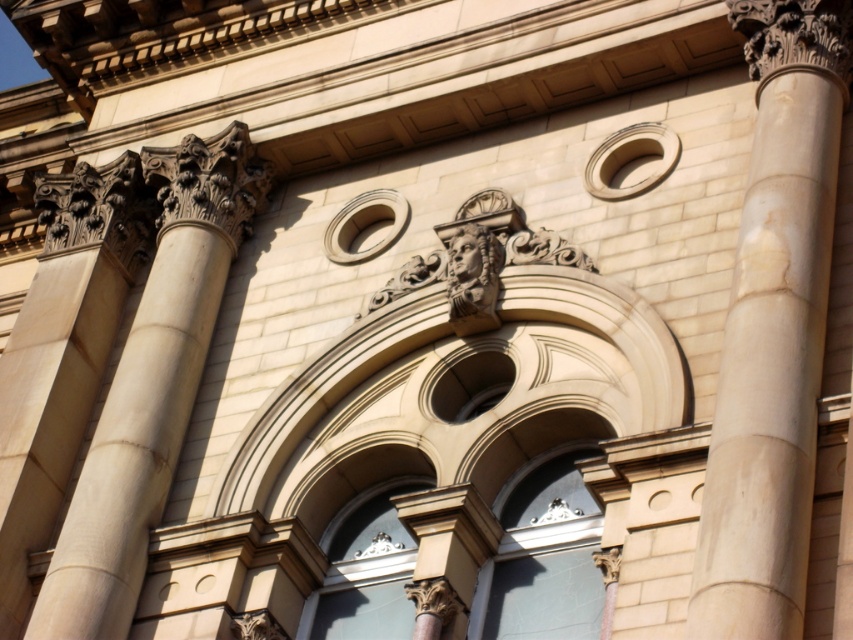
Question: Which is farther from the beige marble column at center?

Choices:
 (A) beige stone column at left
 (B) carved stone face at center

Answer: (A)

Question: Does beige stone column at left appear on the right side of carved stone face at center?

Choices:
 (A) no
 (B) yes

Answer: (A)

Question: Does beige marble column at center lie in front of beige stone column at left?

Choices:
 (A) no
 (B) yes

Answer: (B)

Question: Among these points, which one is farthest from the camera?

Choices:
 (A) (788, 541)
 (B) (479, 257)

Answer: (B)

Question: Is beige stone column at left below carved stone face at center?

Choices:
 (A) no
 (B) yes

Answer: (B)

Question: Which of the following is the closest to the observer?

Choices:
 (A) beige marble column at center
 (B) carved stone face at center
 (C) beige stone column at left

Answer: (A)